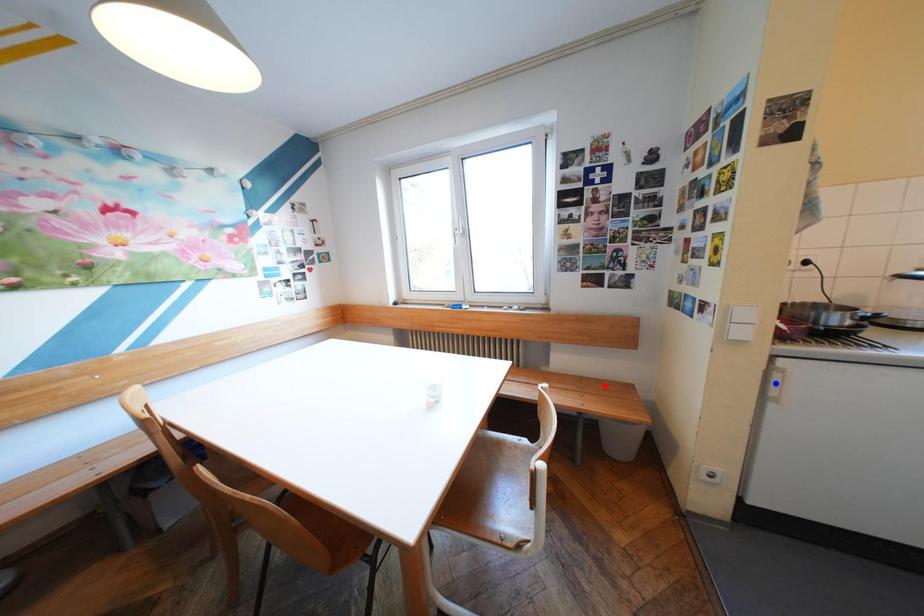
Question: Which of the two points in the image is closer to the camera?

Choices:
 (A) Blue point is closer.
 (B) Red point is closer.

Answer: (A)